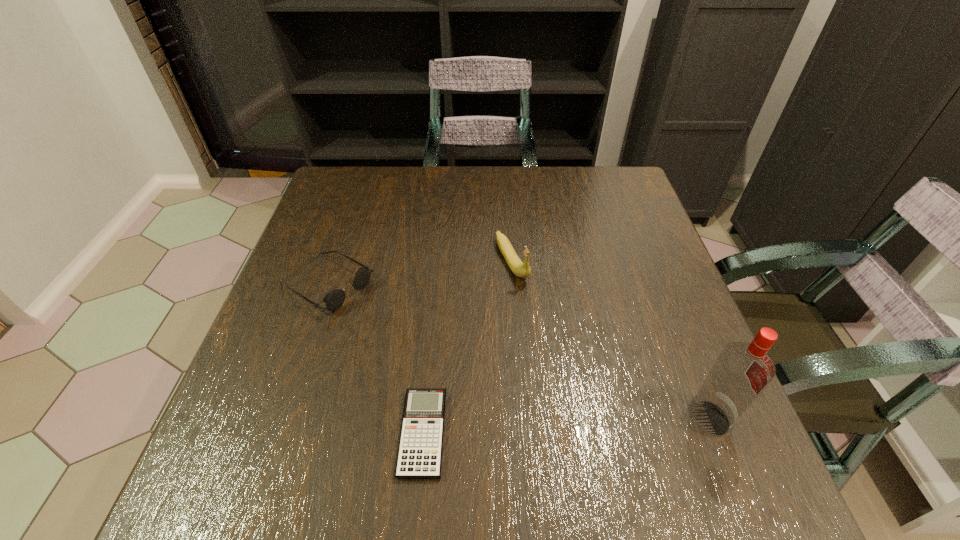
I want to click on free space that is in between the shortest object and the leftmost object, so click(x=375, y=359).

Find the location of a particular element. empty space between the leftmost object and the second tallest object is located at coordinates (420, 273).

Image resolution: width=960 pixels, height=540 pixels. What are the coordinates of `free area in between the tallest object and the second tallest object` in the screenshot? It's located at (611, 340).

Find the location of `free space between the sunglasses and the second object from left to right`. free space between the sunglasses and the second object from left to right is located at coordinates (375, 359).

Find the location of `free point between the tallest object and the sunglasses`. free point between the tallest object and the sunglasses is located at coordinates (518, 352).

Choose which object is the second nearest neighbor to the sunglasses. Please provide its 2D coordinates. Your answer should be formatted as a tuple, i.e. [(x, y)], where the tuple contains the x and y coordinates of a point satisfying the conditions above.

[(520, 269)]

Where is `the third closest object to the sunglasses`? the third closest object to the sunglasses is located at coordinates (742, 371).

Locate an element on the screen. The image size is (960, 540). vacant area in the image that satisfies the following two spatial constraints: 1. on the back side of the second object from left to right; 2. on the right side of the second object from right to left is located at coordinates (440, 261).

Where is `free location that satisfies the following two spatial constraints: 1. on the back side of the banana; 2. on the left side of the sunglasses`? This screenshot has width=960, height=540. free location that satisfies the following two spatial constraints: 1. on the back side of the banana; 2. on the left side of the sunglasses is located at coordinates (336, 261).

I want to click on free space that satisfies the following two spatial constraints: 1. on the front side of the vodka; 2. on the front label of the second shortest object, so click(283, 418).